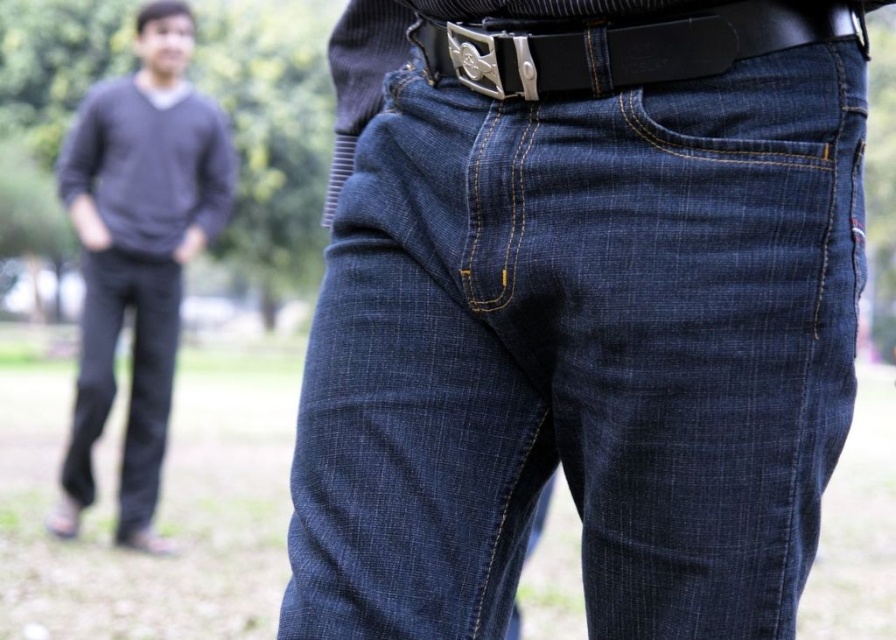
Question: Which object is positioned closest to the black leather belt at center?

Choices:
 (A) dark gray sweater at upper left
 (B) dark blue denim jeans at center
 (C) dark blue denim jeans at lower left

Answer: (B)

Question: From the image, what is the correct spatial relationship of black leather belt at center in relation to dark blue denim jeans at lower left?

Choices:
 (A) left
 (B) right

Answer: (B)

Question: Does black leather belt at center come behind dark blue denim jeans at lower left?

Choices:
 (A) yes
 (B) no

Answer: (B)

Question: Which point is farther from the camera taking this photo?

Choices:
 (A) (57, 513)
 (B) (540, 404)

Answer: (A)

Question: Can you confirm if dark gray sweater at upper left is smaller than black leather belt at center?

Choices:
 (A) yes
 (B) no

Answer: (B)

Question: Among these points, which one is nearest to the camera?

Choices:
 (A) (157, 483)
 (B) (109, 364)
 (C) (661, 257)
 (D) (505, 35)

Answer: (C)